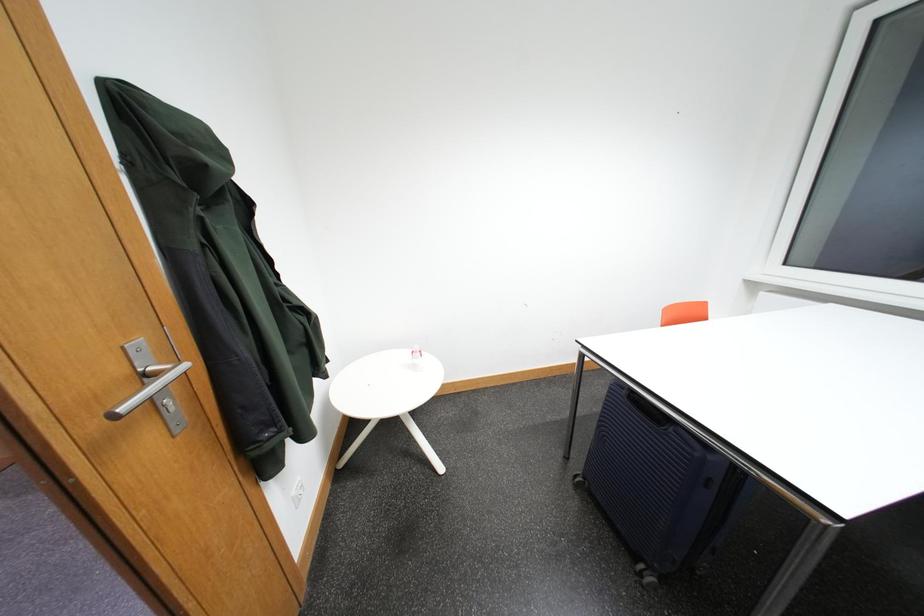
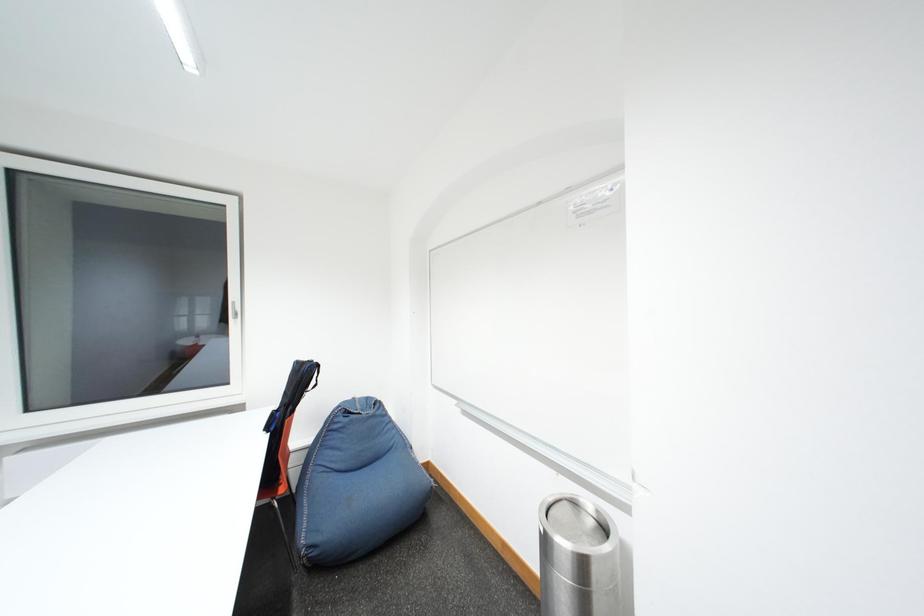
Question: How did the camera likely rotate?

Choices:
 (A) Left
 (B) Right
 (C) Up
 (D) Down

Answer: (B)